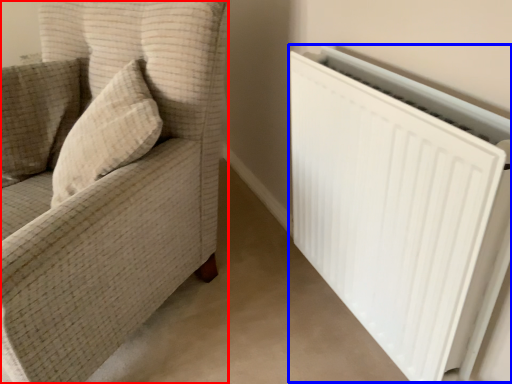
Question: Among these objects, which one is farthest to the camera, furniture (highlighted by a red box) or radiator (highlighted by a blue box)?

Choices:
 (A) furniture
 (B) radiator

Answer: (B)